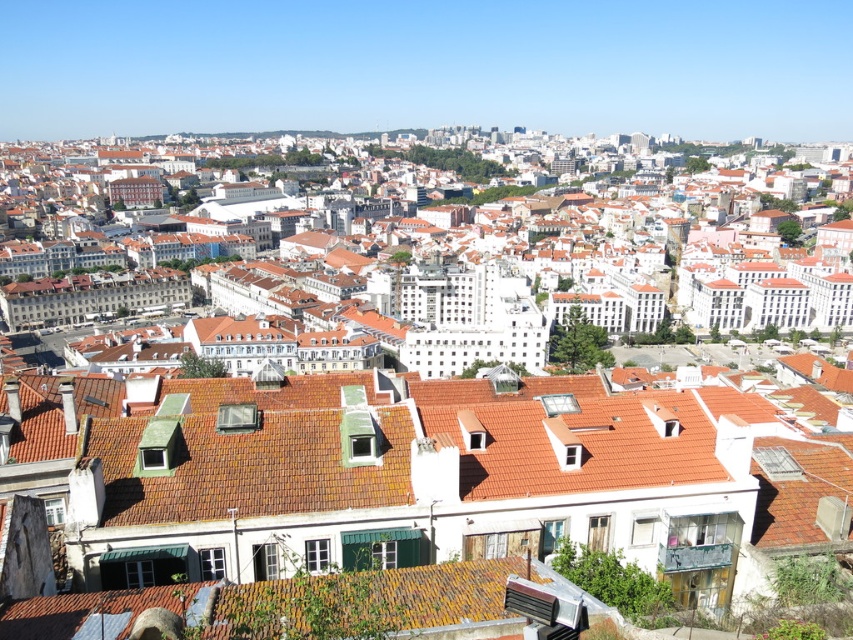
Question: Observing the image, what is the correct spatial positioning of brown tile roof at center in reference to orange tiled roofs at center?

Choices:
 (A) below
 (B) above

Answer: (A)

Question: Is the position of brown tile roof at center less distant than that of orange tiled roofs at center?

Choices:
 (A) yes
 (B) no

Answer: (A)

Question: Among these objects, which one is nearest to the camera?

Choices:
 (A) brown tile roof at center
 (B) orange tiled roofs at center

Answer: (A)

Question: Does brown tile roof at center appear over orange tiled roofs at center?

Choices:
 (A) no
 (B) yes

Answer: (A)

Question: Which object appears farthest from the camera in this image?

Choices:
 (A) brown tile roof at center
 (B) orange tiled roofs at center

Answer: (B)